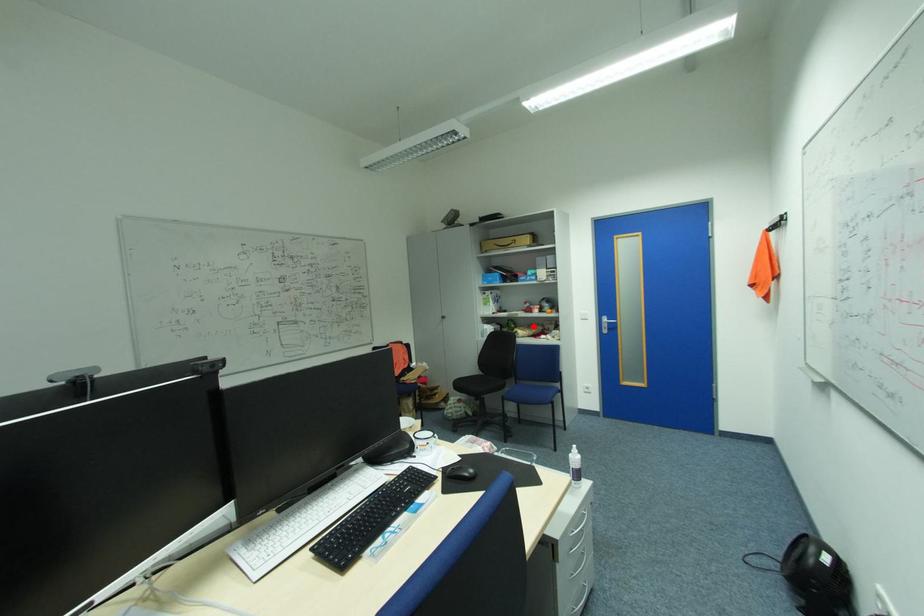
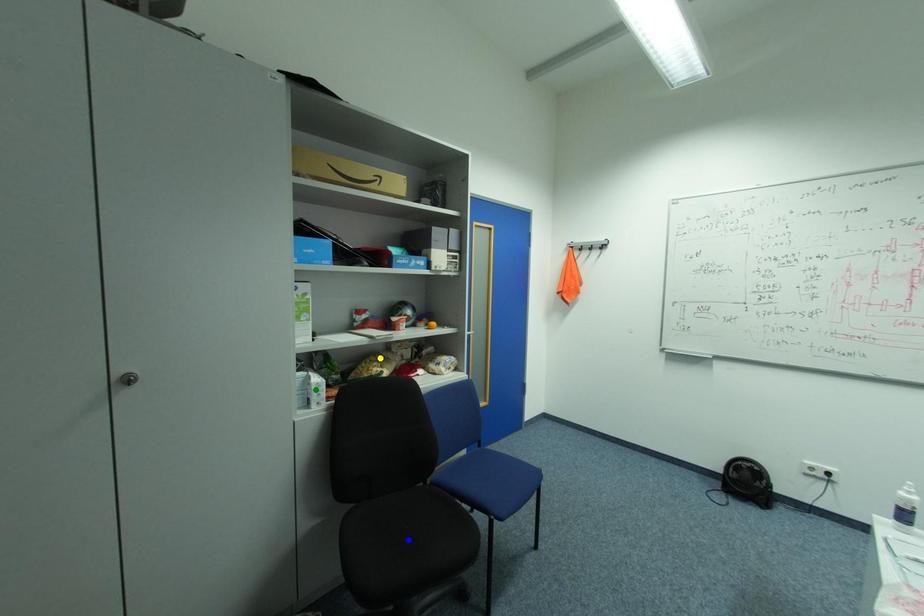
Question: I am providing you with two images of the same scene from different viewpoints. A red point is marked on the first image. You are given multiple points on the second image. Which spot in image 2 lines up with the point in image 1?

Choices:
 (A) yellow point
 (B) green point
 (C) blue point

Answer: (A)